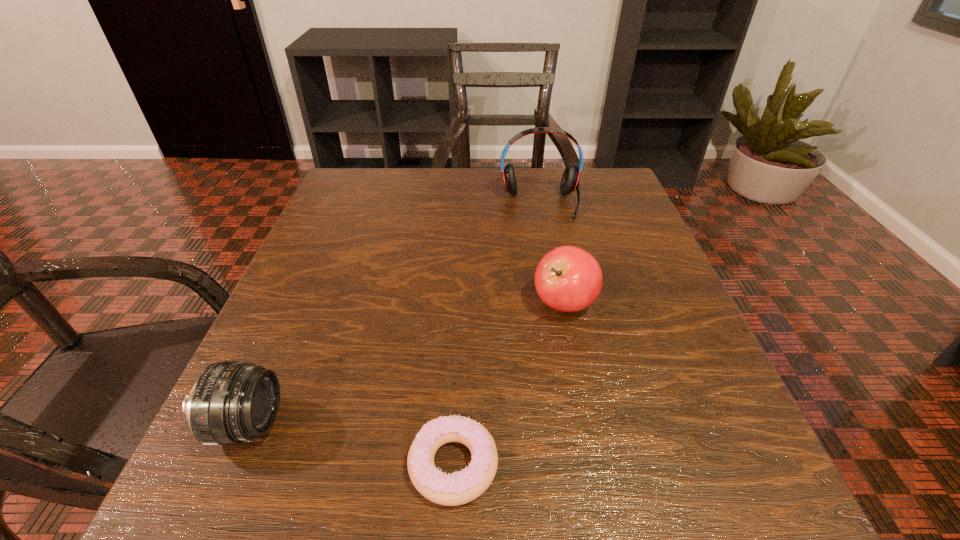
This screenshot has width=960, height=540. In order to click on object positioned at the far edge in this screenshot , I will do tap(570, 182).

The height and width of the screenshot is (540, 960). Identify the location of telephoto lens that is at the near edge. (231, 402).

Identify the location of doughnut at the near edge. This screenshot has width=960, height=540. click(459, 488).

Find the location of a particular element. The width and height of the screenshot is (960, 540). object located in the left edge section of the desktop is located at coordinates 231,402.

Find the location of a particular element. The image size is (960, 540). headset located at the right edge is located at coordinates (570, 182).

At what (x,y) coordinates should I click in order to perform the action: click on apple that is at the right edge. Please return your answer as a coordinate pair (x, y). Looking at the image, I should click on (568, 279).

Locate an element on the screen. The image size is (960, 540). object that is at the near left corner is located at coordinates (231, 402).

You are a GUI agent. You are given a task and a screenshot of the screen. Output one action in this format:
    pyautogui.click(x=<x>, y=<y>)
    Task: Click on the object that is at the far right corner
    Image resolution: width=960 pixels, height=540 pixels.
    Given the screenshot: What is the action you would take?
    pyautogui.click(x=570, y=182)

Locate an element on the screen. The image size is (960, 540). blank space at the far edge of the desktop is located at coordinates (418, 194).

Identify the location of vacant area at the left edge of the desktop. 325,296.